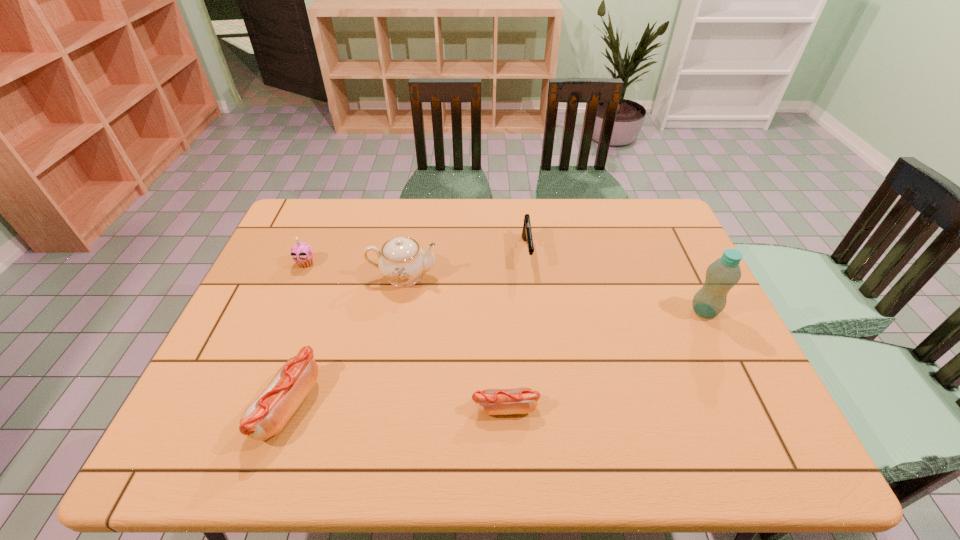
In order to click on free space located 0.120m on the back of the taller sausage in this screenshot , I will do `click(315, 328)`.

At what (x,y) coordinates should I click in order to perform the action: click on free location located on the left of the shorter sausage. Please return your answer as a coordinate pair (x, y). Image resolution: width=960 pixels, height=540 pixels. Looking at the image, I should click on (410, 408).

Find the location of a particular element. The width and height of the screenshot is (960, 540). blank space located on the face of the cupcake is located at coordinates (270, 348).

Locate an element on the screen. The width and height of the screenshot is (960, 540). vacant space positioned 0.380m at the front cap of the water bottle is located at coordinates [x=551, y=311].

Find the location of a particular element. vacant region located 0.280m at the front cap of the water bottle is located at coordinates (588, 311).

Identify the location of free point located at the front cap of the water bottle. (569, 311).

Find the location of a particular element. vacant position located 0.330m at the aiming end of the second object from right to left is located at coordinates (540, 365).

The width and height of the screenshot is (960, 540). I want to click on vacant space located at the spout of the chinaware, so click(553, 276).

Locate an element on the screen. This screenshot has width=960, height=540. object that is positioned at the far edge is located at coordinates (526, 232).

You are a GUI agent. You are given a task and a screenshot of the screen. Output one action in this format:
    pyautogui.click(x=<x>, y=<y>)
    Task: Click on the sausage located at the left edge
    The image size is (960, 540).
    Given the screenshot: What is the action you would take?
    pyautogui.click(x=267, y=415)